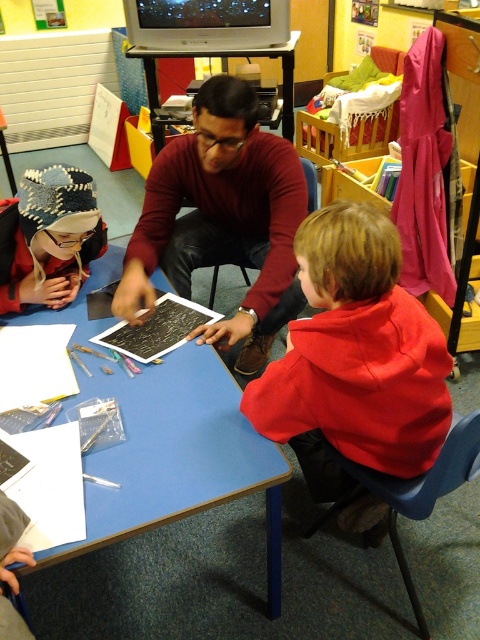
Who is lower down, maroon sweater at center or knitted wool hat at upper left?

Positioned lower is maroon sweater at center.

Who is taller, maroon sweater at center or knitted wool hat at upper left?

maroon sweater at center

What do you see at coordinates (222, 220) in the screenshot? This screenshot has width=480, height=640. I see `maroon sweater at center` at bounding box center [222, 220].

The height and width of the screenshot is (640, 480). In order to click on maroon sweater at center in this screenshot , I will do `click(222, 220)`.

Between maroon sweater at center and blue plastic table at center, which one has more height?

blue plastic table at center is taller.

From the picture: Is maroon sweater at center below blue plastic table at center?

No.

Does point (265, 132) come behind point (157, 436)?

Yes, point (265, 132) is farther from viewer.

You are a GUI agent. You are given a task and a screenshot of the screen. Output one action in this format:
    pyautogui.click(x=<x>, y=<y>)
    Task: Click on the maroon sweater at center
    This screenshot has width=480, height=640.
    Given the screenshot: What is the action you would take?
    pyautogui.click(x=222, y=220)

Does point (331, 324) come behind point (88, 244)?

No, (331, 324) is closer to viewer.

Which is more to the left, red fleece jacket at lower right or knitted wool hat at upper left?

knitted wool hat at upper left is more to the left.

Who is more forward, (x=327, y=492) or (x=58, y=188)?

Positioned in front is point (x=58, y=188).

Find the location of a particular element. This screenshot has width=480, height=640. red fleece jacket at lower right is located at coordinates (355, 358).